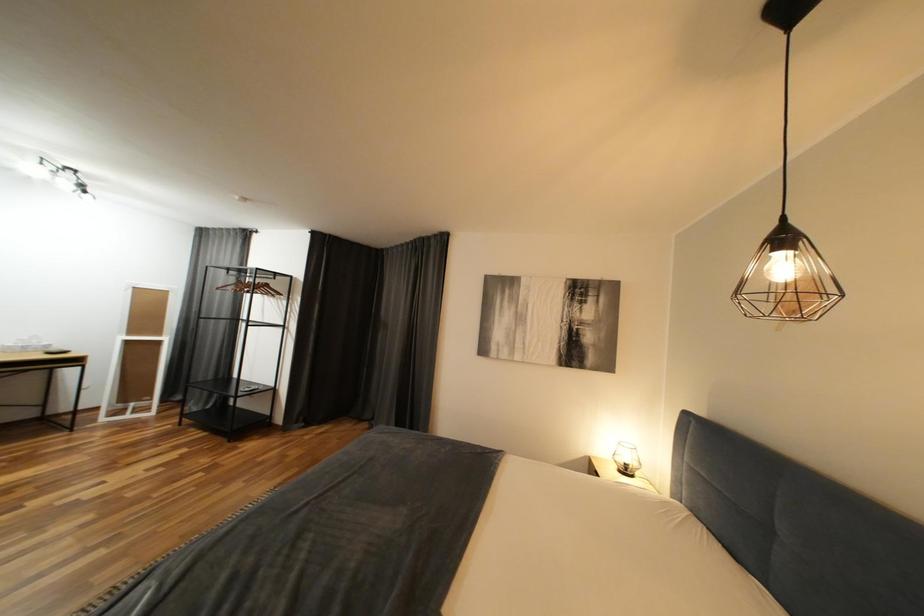
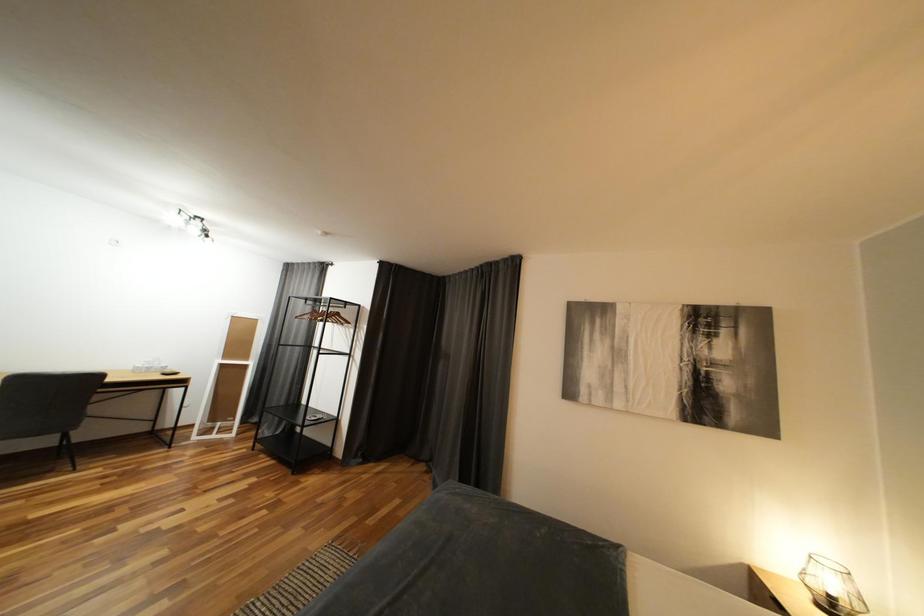
Which direction would the cameraman need to move to produce the second image?

The cameraman moved toward left, forward.